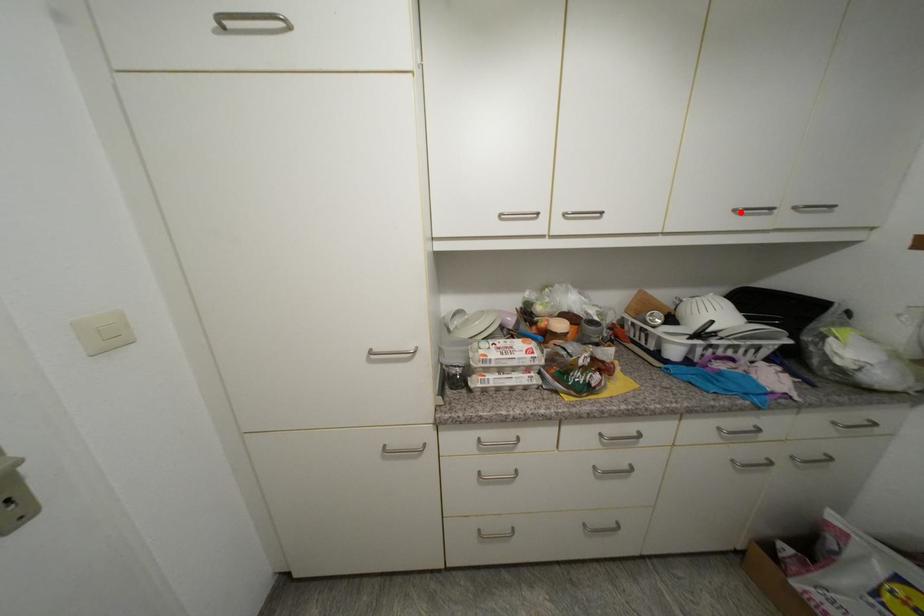
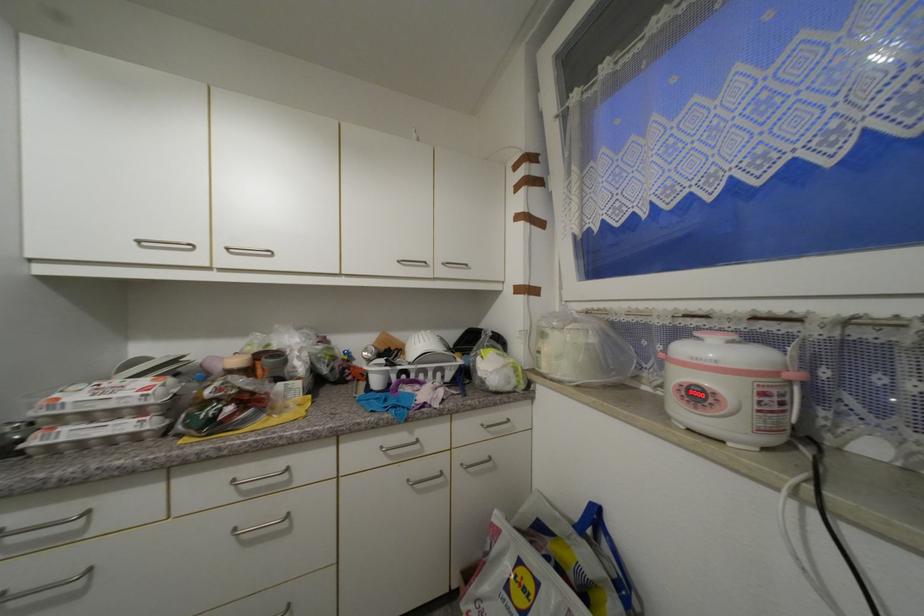
The point at the highlighted location is marked in the first image. Where is the corresponding point in the second image?

(405, 262)